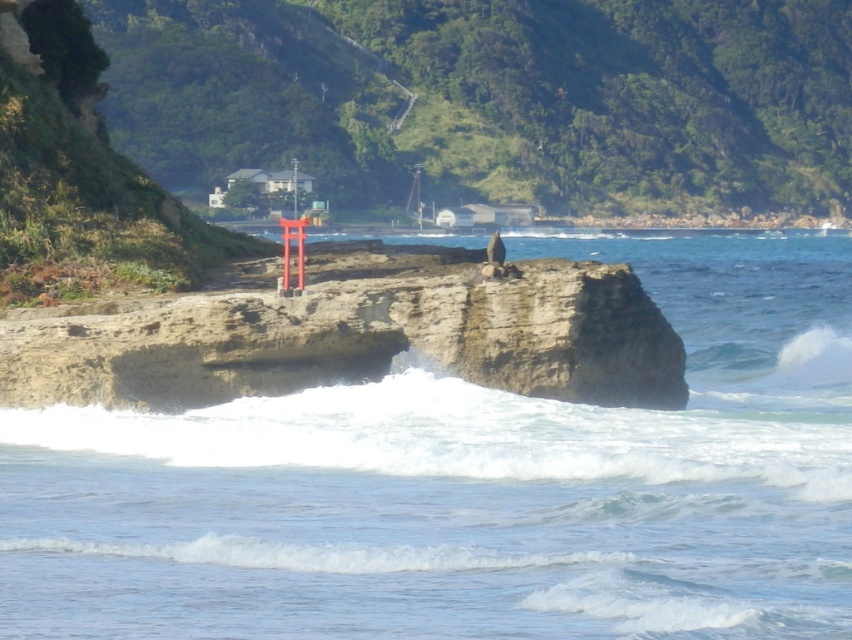
You are a boat captain navigating a narrow channel. You see the clear blue water at center and the rusty stone cliff at center. Which path should you choose to avoid collision with the cliff?

The clear blue water at center is wider than the rusty stone cliff at center, so you should choose the clear blue water at center to avoid collision with the cliff.